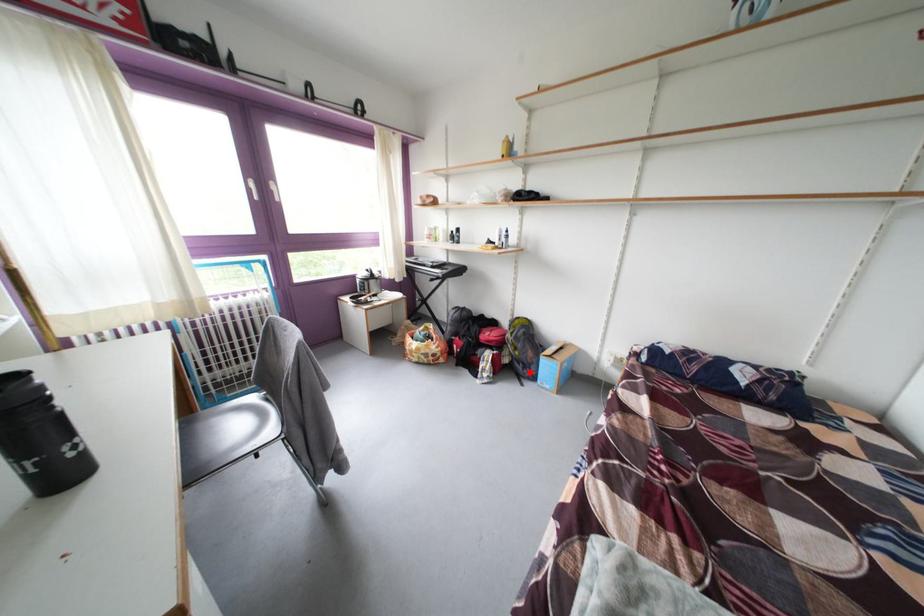
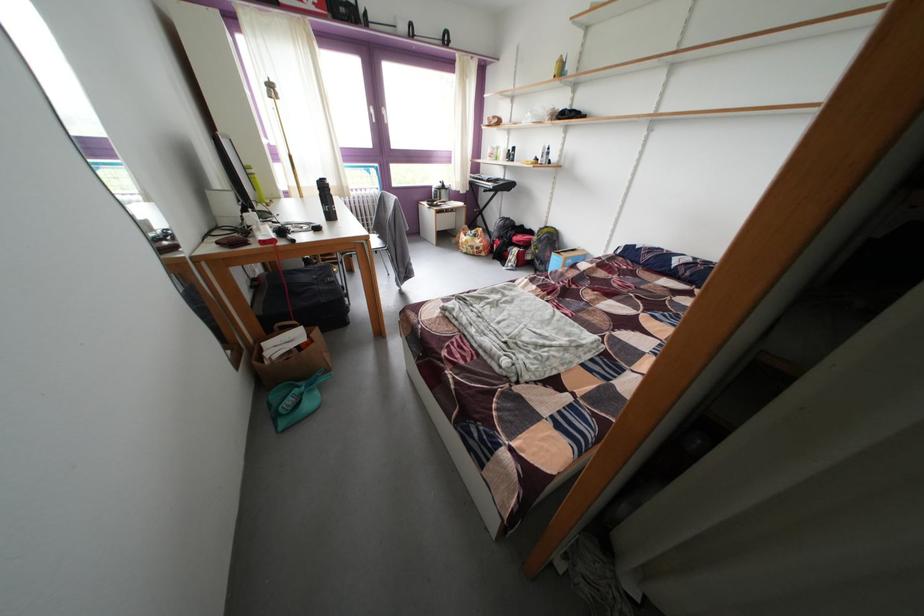
The point at the highlighted location is marked in the first image. Where is the corresponding point in the second image?

(548, 269)